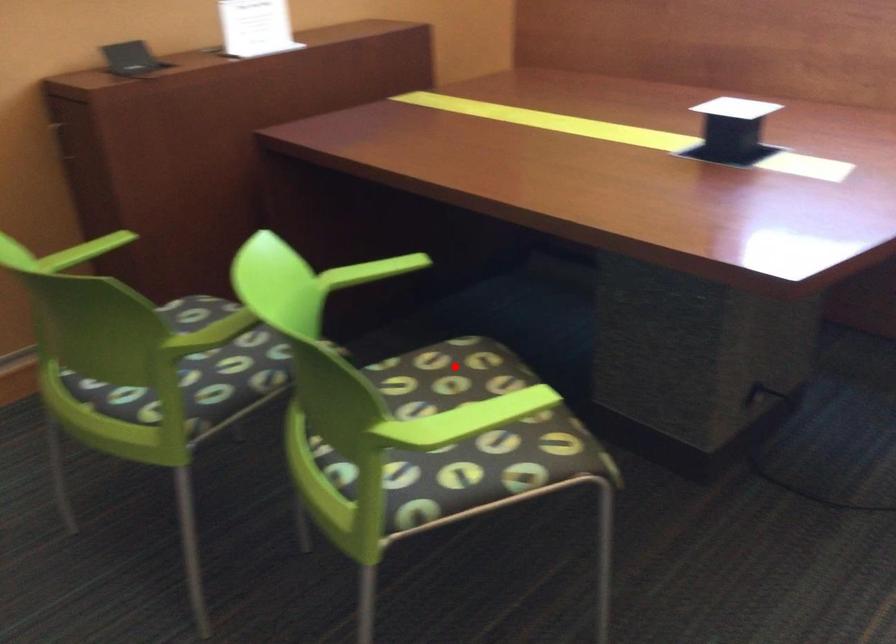
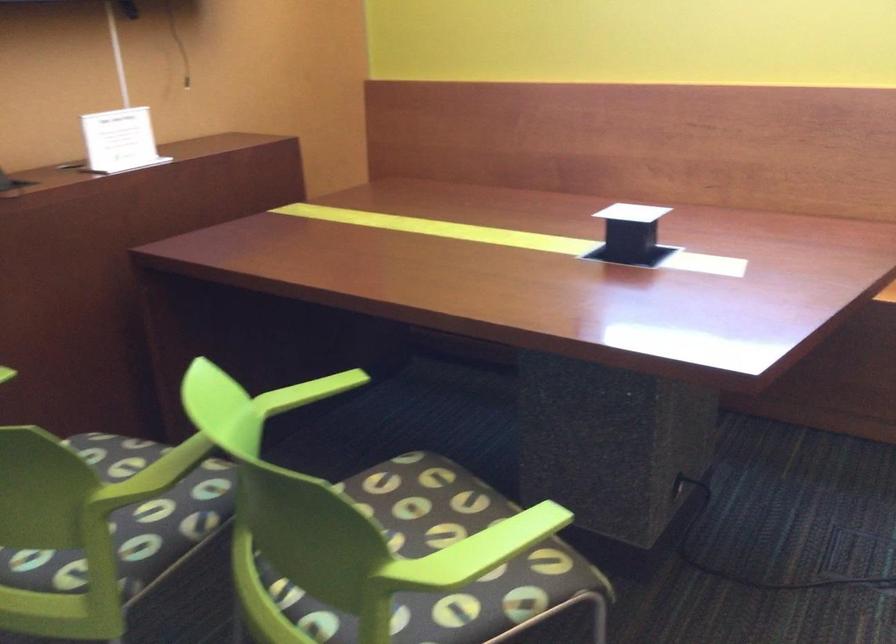
In the second image, find the point that corresponds to the highlighted location in the first image.

(403, 487)